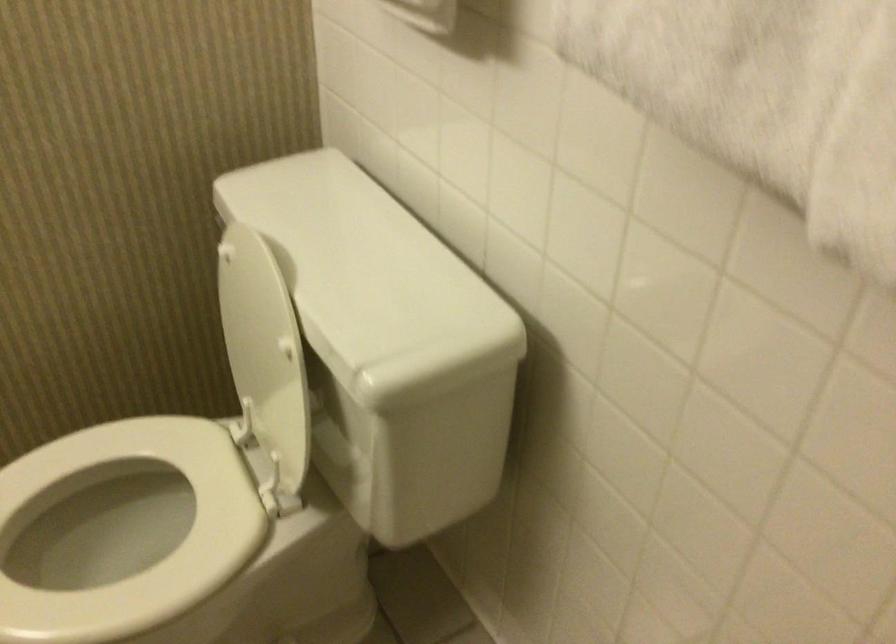
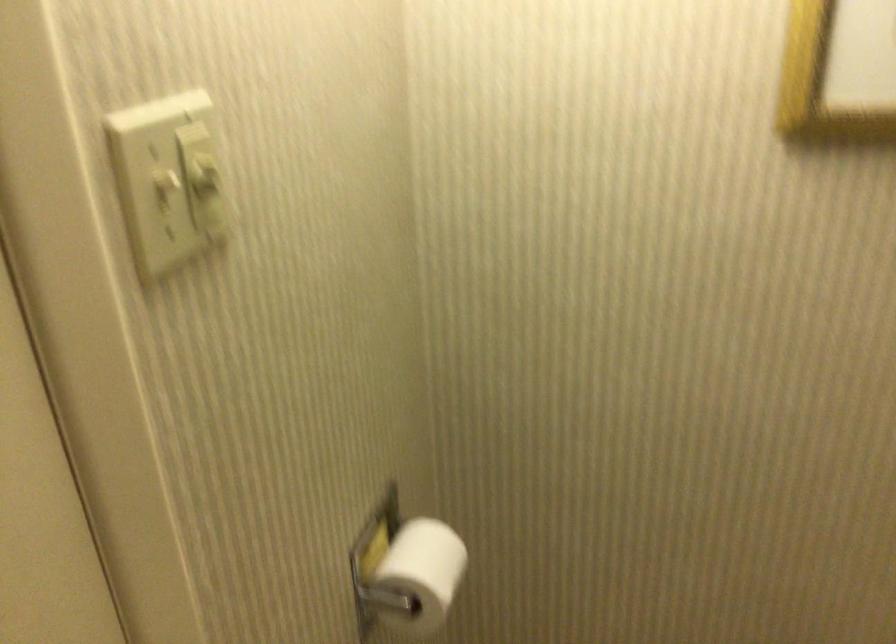
Question: The images are taken continuously from a first-person perspective. In which direction is your viewpoint rotating?

Choices:
 (A) Left
 (B) Right
 (C) Up
 (D) Down

Answer: (A)